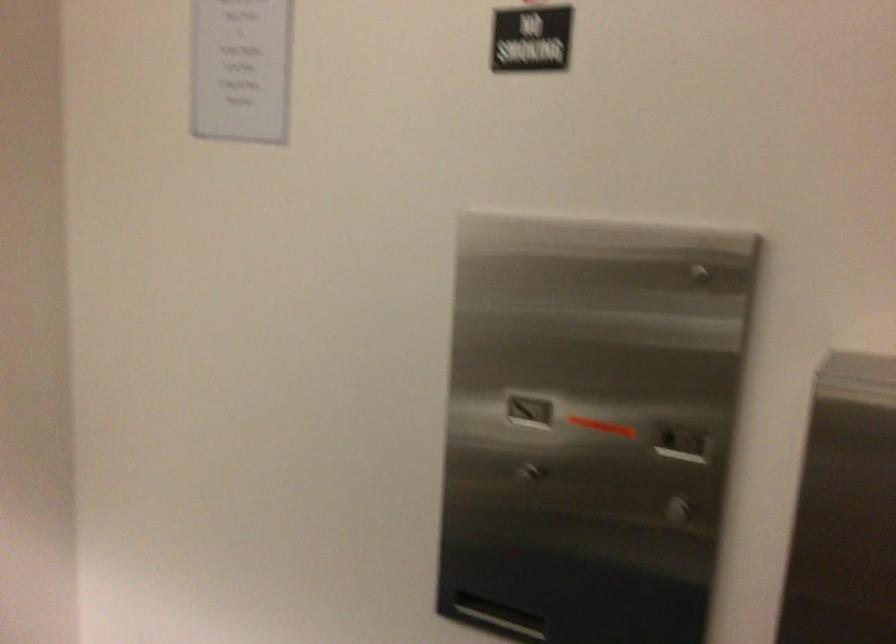
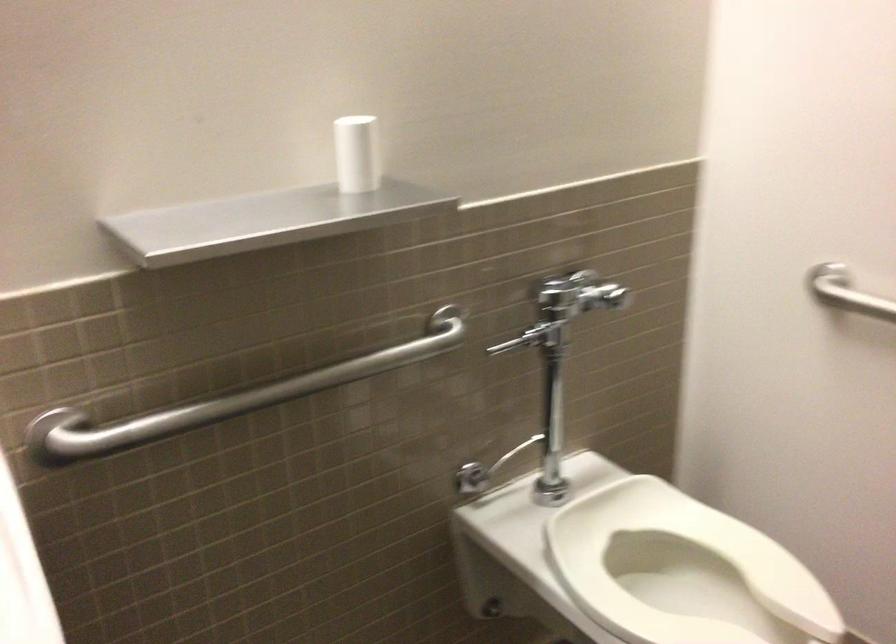
Based on the continuous images, in which direction is the camera rotating?

The rotation direction of the camera is left-down.